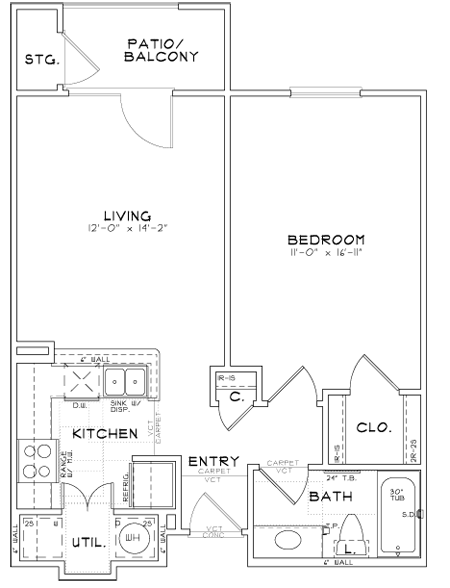
Find the location of a particular element. This screenshot has height=588, width=450. room you sleep in is located at coordinates (328, 252).